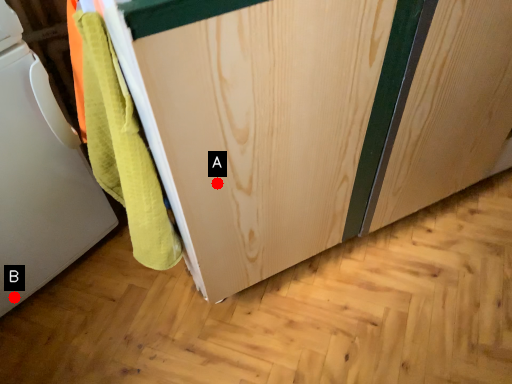
Question: Two points are circled on the image, labeled by A and B beside each circle. Which point is closer to the camera?

Choices:
 (A) A is closer
 (B) B is closer

Answer: (A)